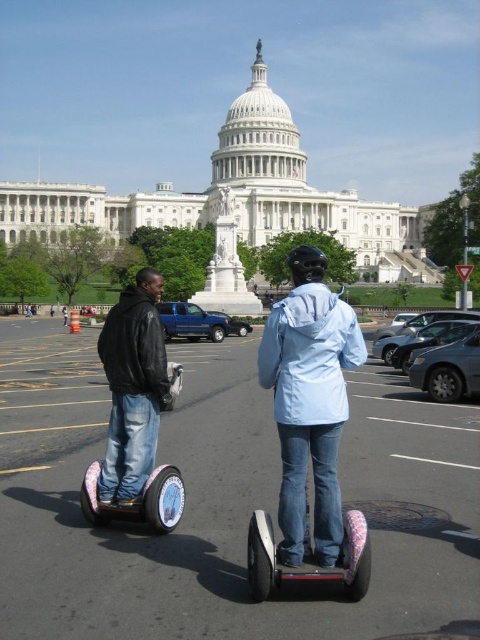
Question: Which point is closer to the camera?

Choices:
 (A) metallic blue scooter at center
 (B) black leather jacket at left
 (C) black rubber segway at center
 (D) light blue fabric jacket at center

Answer: (C)

Question: Which object appears farthest from the camera in this image?

Choices:
 (A) metallic blue scooter at center
 (B) light blue fabric jacket at center

Answer: (A)

Question: Is light blue fabric jacket at center to the right of black leather jacket at left from the viewer's perspective?

Choices:
 (A) yes
 (B) no

Answer: (A)

Question: Is black leather jacket at left below metallic blue scooter at center?

Choices:
 (A) yes
 (B) no

Answer: (B)

Question: Considering the real-world distances, which object is closest to the metallic blue scooter at center?

Choices:
 (A) black rubber segway at center
 (B) light blue fabric jacket at center

Answer: (B)

Question: Is light blue fabric jacket at center to the right of metallic blue scooter at center from the viewer's perspective?

Choices:
 (A) no
 (B) yes

Answer: (B)